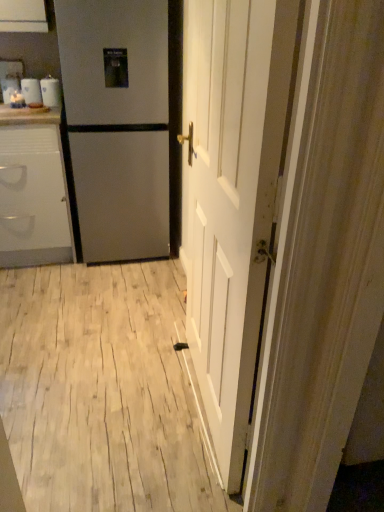
Locate an element on the screen. vacant area that lies between white glossy cabinet at left and white wooden door at center is located at coordinates (102, 325).